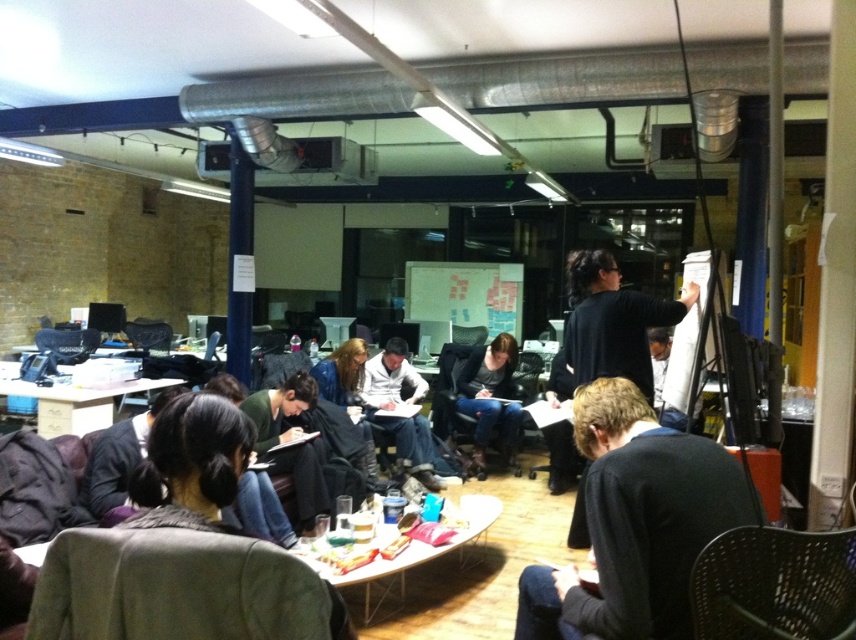
You are organizing a small event and need to place a 20 cm wide decorative item on the surface next to the black sweater at lower right. Will there be enough space considering the width of the matte black chair at left?

The black sweater at lower right has a lesser width compared to the matte black chair at left, so the space next to the black sweater at lower right may be narrower. Since the decorative item is only 20 cm wide, it might fit if the available space is sufficient. However, without exact measurements of the space, it is uncertain. Please check the actual dimensions.

You are standing at the entrance of the room and see the point marked at coordinates (635,522). What object is located at that point?

The point marked at coordinates (635,522) corresponds to the black sweater at lower right.